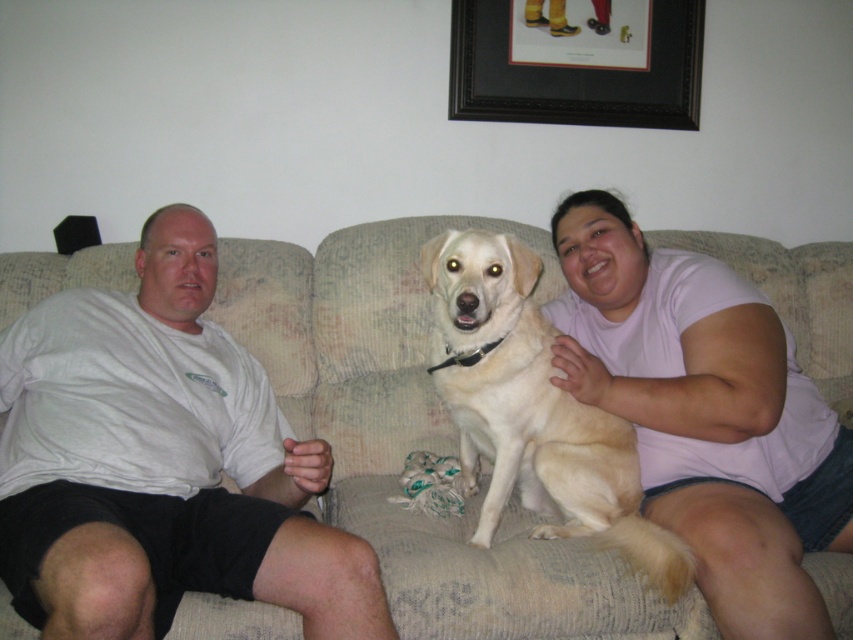
Question: Which point is farther from the camera taking this photo?

Choices:
 (A) (485, 372)
 (B) (683, 483)

Answer: (A)

Question: Can you confirm if matte pink shirt at center is positioned above black wood picture frame at upper center?

Choices:
 (A) yes
 (B) no

Answer: (B)

Question: Observing the image, what is the correct spatial positioning of beige fabric couch at center in reference to white cotton shirt at left?

Choices:
 (A) above
 (B) below

Answer: (A)

Question: Among these points, which one is farthest from the camera?

Choices:
 (A) (338, 275)
 (B) (505, 364)
 (C) (560, 252)

Answer: (A)

Question: Does white cotton shirt at left appear on the left side of matte pink shirt at center?

Choices:
 (A) no
 (B) yes

Answer: (B)

Question: Estimate the real-world distances between objects in this image. Which object is closer to the matte pink shirt at center?

Choices:
 (A) black wood picture frame at upper center
 (B) light yellow fur at center
 (C) white cotton shirt at left

Answer: (B)